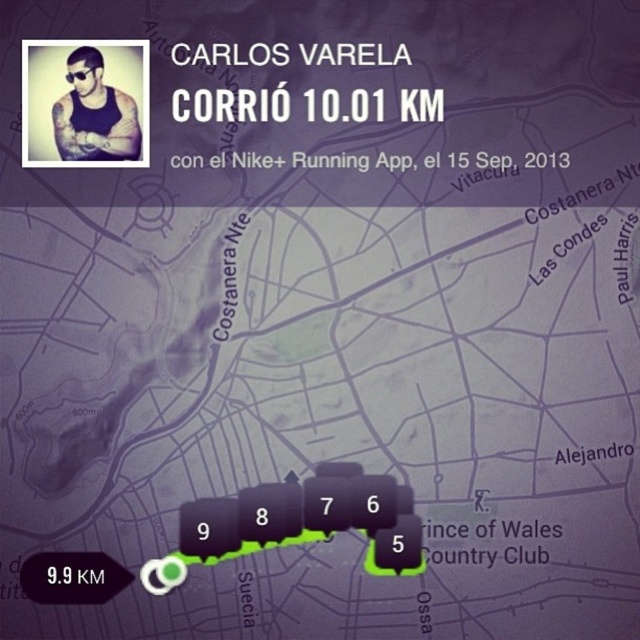
You are looking at Carlos Varela in the Nike app screenshot. You notice a matte black tank top at upper left and a black plastic goggles at upper left. Which one is closer to you?

The matte black tank top at upper left is closer to you because it is in front of the black plastic goggles at upper left.

You are using the Nike app and see two points on the map. The first point is at coordinates point (x=116, y=140) and the second is at point (x=77, y=76). Which point is closer to you when looking at the map?

Point (x=116, y=140) is further to the viewer than point (x=77, y=76), so point (x=77, y=76) is closer to you.

Carlos is wearing two items in the photo. Which one is taller between the matte black tank top at upper left and the black plastic goggles at upper left?

The matte black tank top at upper left is taller than the black plastic goggles at upper left.